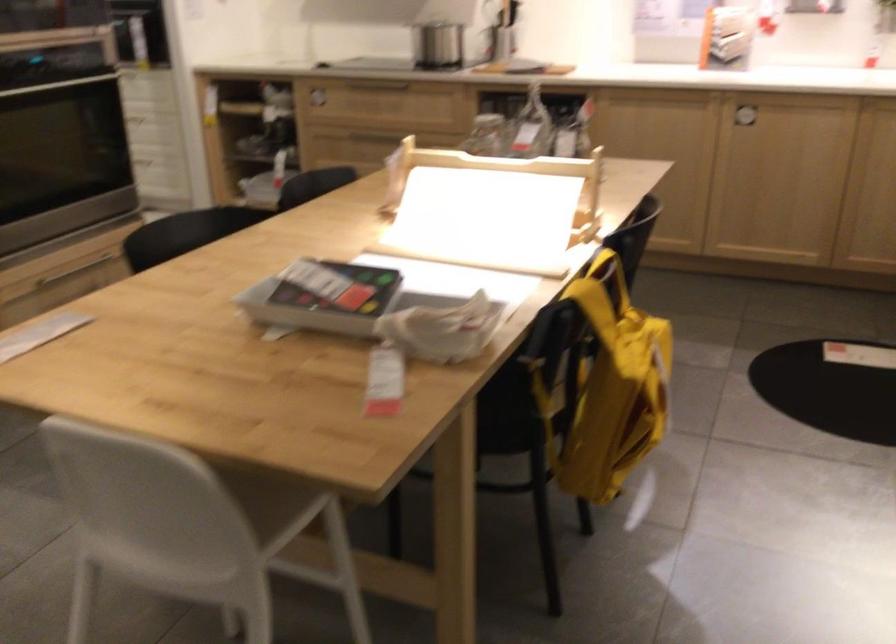
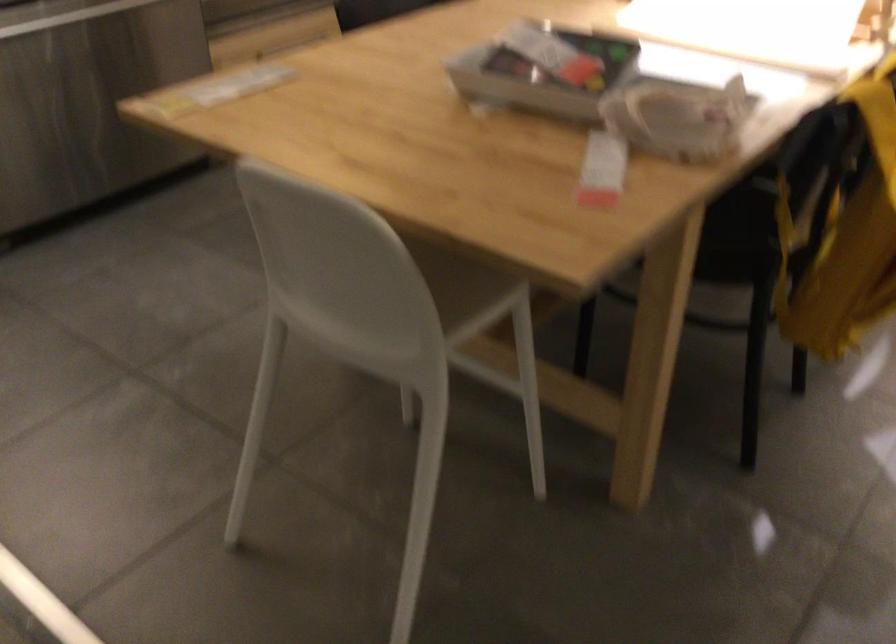
Find the pixel in the second image that matches pixel 323 299 in the first image.

(544, 73)